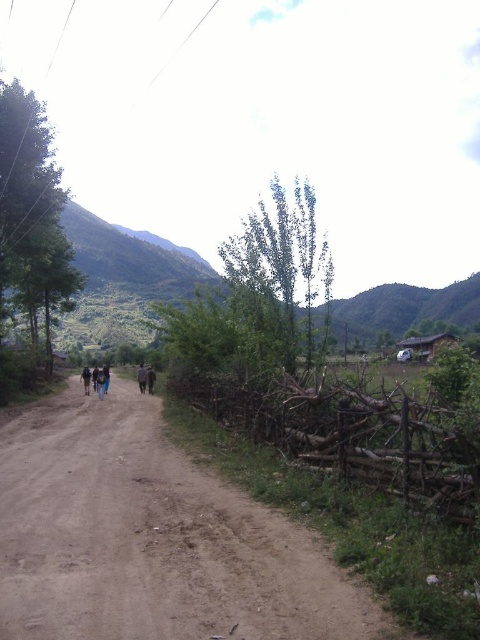
You are standing on the dirt road and see the green grassy mountain at upper left and the dark brown leather jacket at center. Which object is located to the right of the other?

The green grassy mountain at upper left is positioned on the right side of dark brown leather jacket at center, so the mountain is to the right of the jacket.

You are standing on the dark blue jeans at center and want to walk along the brown dirt track at center. Which direction should you head to stay on the track?

The brown dirt track at center is positioned on the right side of dark blue jeans at center, so you should head to the right to stay on the track.

You are standing at the center of the dirt road in the rural scene. Looking towards the green grassy mountain at upper left, in which direction relative to your position would you find it?

The green grassy mountain at upper left is located at the upper left direction from your position on the dirt road.